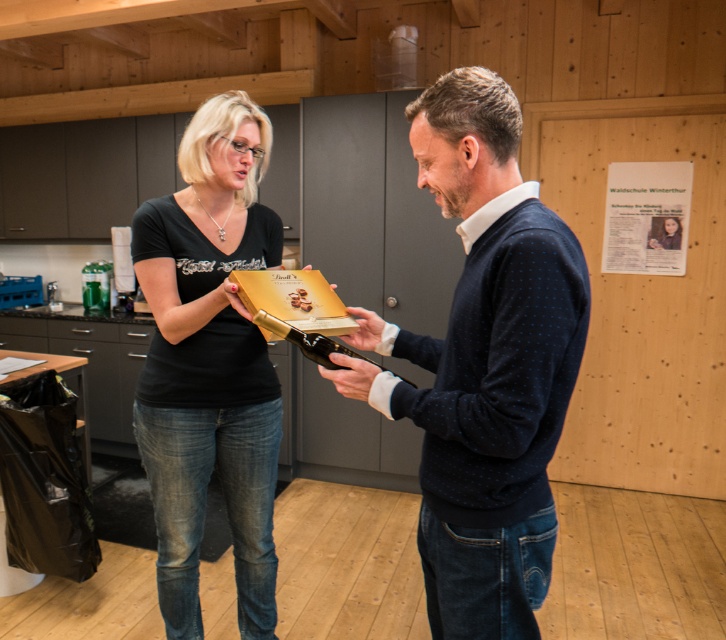
In the scene shown: You are a delivery person who needs to place a small package in the kitchen. The package must be placed on a surface that is taller than the matte black shirt at center. Can you place the package on the matte gold box at center?

The matte gold box at center is not as tall as the matte black shirt at center, so it is shorter. Therefore, the package cannot be placed on the matte gold box at center because it is not taller than the matte black shirt at center.